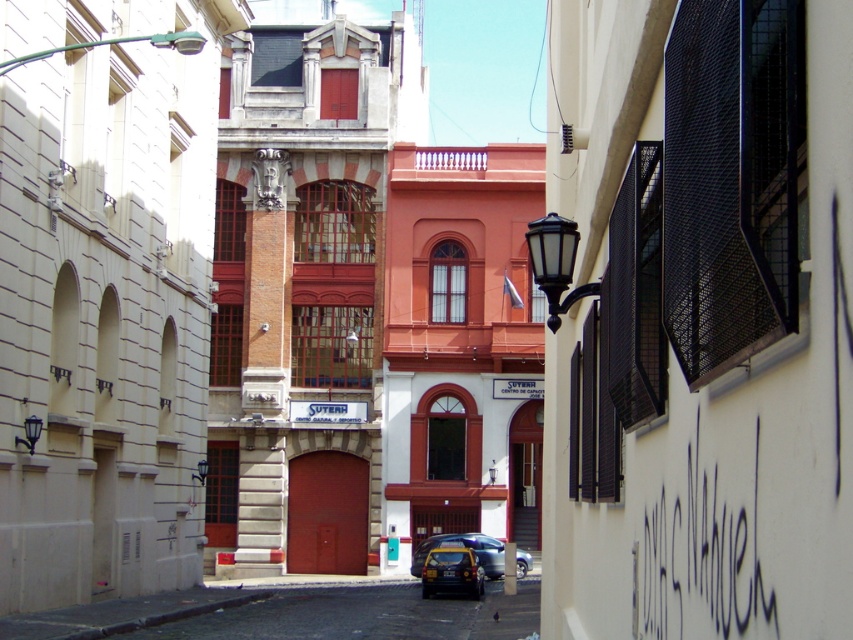
You are a delivery person who needs to park your shiny black car at center in a parking spot located at coordinates 0.9, 0.5. Will your car fit perfectly in the spot?

The shiny black car at center is positioned at point (451, 572), which is very close to the parking spot at (426, 576). The slight difference in coordinates suggests the car is nearly aligned but may not fit perfectly due to the minor offset in both x and y axes.

You are a delivery driver trying to park your truck, which is 2 meters wide, in this narrow street. You see a shiny black car at center and a metallic blue car at center blocking the path. Can your truck fit between them if there is a gap between the two cars?

The shiny black car at center is narrower than the metallic blue car at center. However, without knowing the exact gap size between them, it is impossible to determine if the 2 meter wide truck can fit through.

You are a delivery person standing at the point marked as point (451, 572). You need to deliver a package to the shiny black car at center. Is the shiny black car at center visible from your current position?

The shiny black car at center is located at point (451, 572), so yes, the delivery person can see the shiny black car at center from their current position.